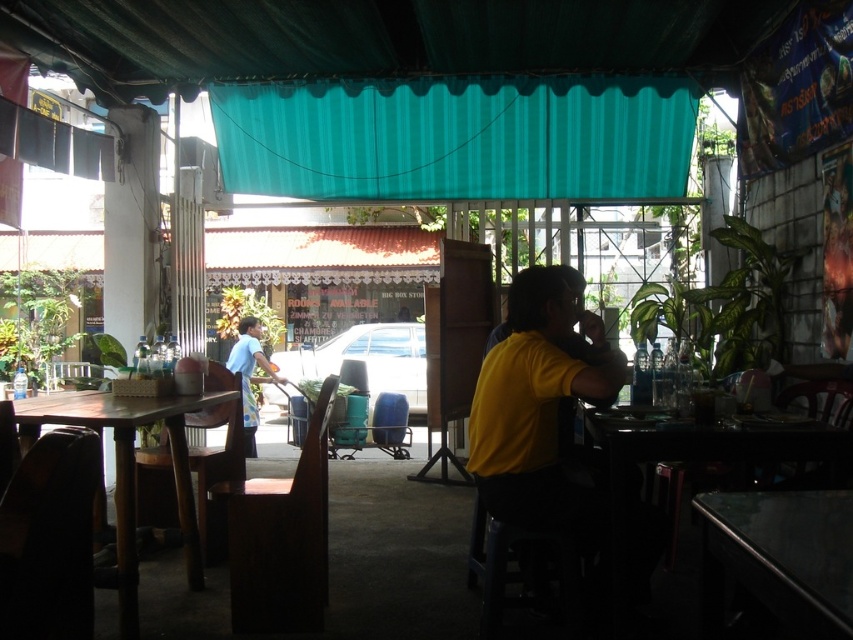
Question: Which object is the closest to the wooden chair at lower right?

Choices:
 (A) wooden table at left
 (B) metallic blue chair at center
 (C) teal corrugated plastic awning at upper center

Answer: (A)

Question: Does shiny black table at lower right appear under metallic blue chair at center?

Choices:
 (A) no
 (B) yes

Answer: (A)

Question: Does wooden chair at left appear on the left side of wooden chair at lower right?

Choices:
 (A) no
 (B) yes

Answer: (B)

Question: Which object is positioned closest to the wooden chair at left?

Choices:
 (A) shiny black table at lower right
 (B) teal corrugated plastic awning at upper center
 (C) wooden chair at lower left
 (D) light blue fabric apron at center

Answer: (C)

Question: Based on their relative distances, which object is farther from the metallic blue chair at center?

Choices:
 (A) brown wooden chair at left
 (B) teal corrugated plastic awning at upper center
 (C) wooden chair at left
 (D) light blue fabric apron at center

Answer: (A)

Question: Does metallic blue chair at center have a smaller size compared to light blue fabric apron at center?

Choices:
 (A) yes
 (B) no

Answer: (A)